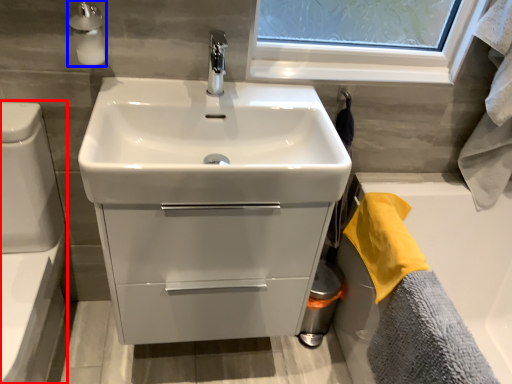
Question: Which object appears farthest to the camera in this image, toilet bowl (highlighted by a red box) or soap dispenser (highlighted by a blue box)?

Choices:
 (A) toilet bowl
 (B) soap dispenser

Answer: (B)